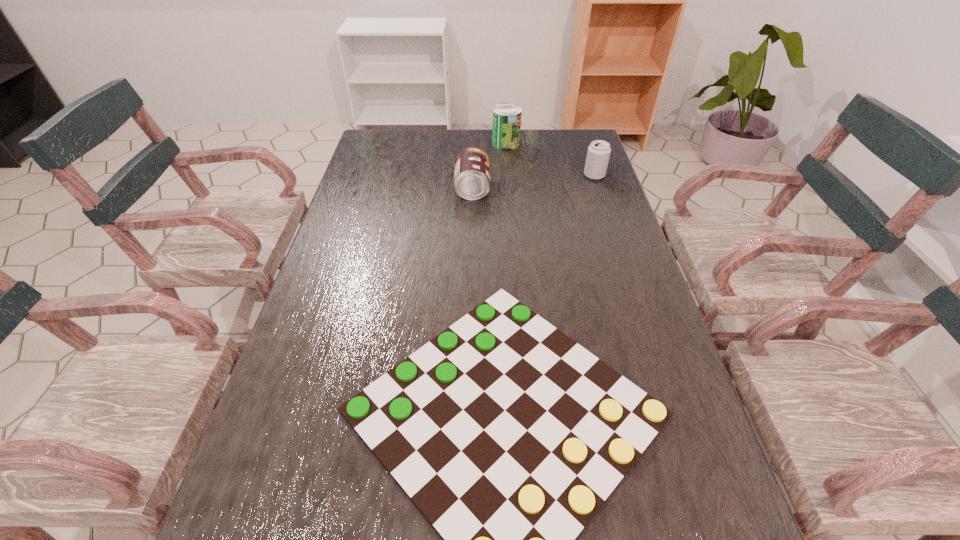
I want to click on object that is the second closest to the rightmost can, so click(472, 165).

Identify which can is located as the second nearest to the nearest object. Please provide its 2D coordinates. Your answer should be formatted as a tuple, i.e. [(x, y)], where the tuple contains the x and y coordinates of a point satisfying the conditions above.

[(598, 154)]

Select which can appears as the closest to the farthest can. Please provide its 2D coordinates. Your answer should be formatted as a tuple, i.e. [(x, y)], where the tuple contains the x and y coordinates of a point satisfying the conditions above.

[(472, 165)]

This screenshot has height=540, width=960. I want to click on blank space that satisfies the following two spatial constraints: 1. on the front side of the farthest can; 2. on the front label of the leftmost can, so click(x=510, y=188).

Where is `vacant area that satisfies the following two spatial constraints: 1. on the front side of the farthest object; 2. on the front label of the leftmost can`? vacant area that satisfies the following two spatial constraints: 1. on the front side of the farthest object; 2. on the front label of the leftmost can is located at coordinates (510, 188).